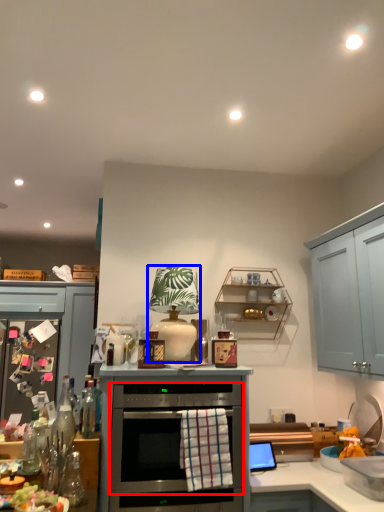
Question: Which object appears farthest to the camera in this image, oven (highlighted by a red box) or appliance (highlighted by a blue box)?

Choices:
 (A) oven
 (B) appliance

Answer: (B)